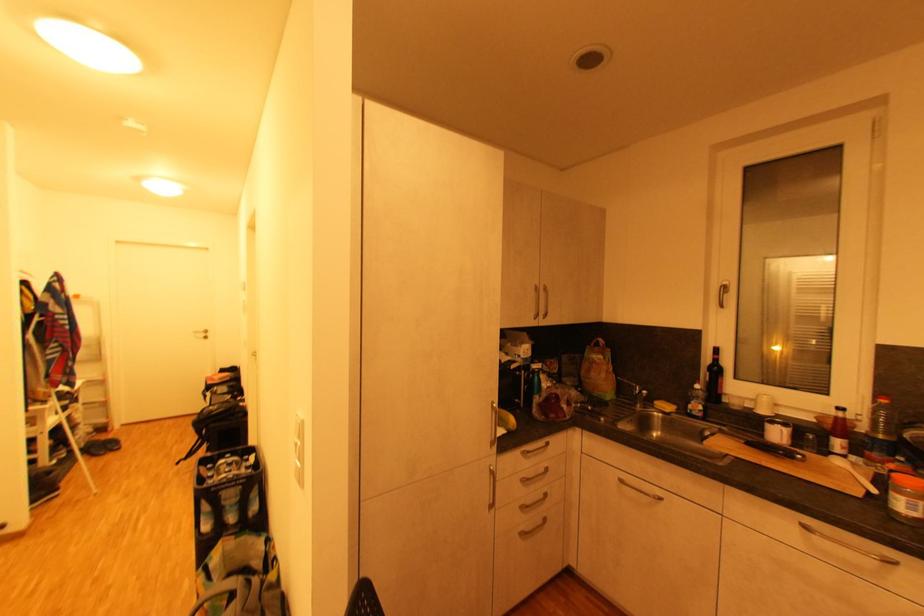
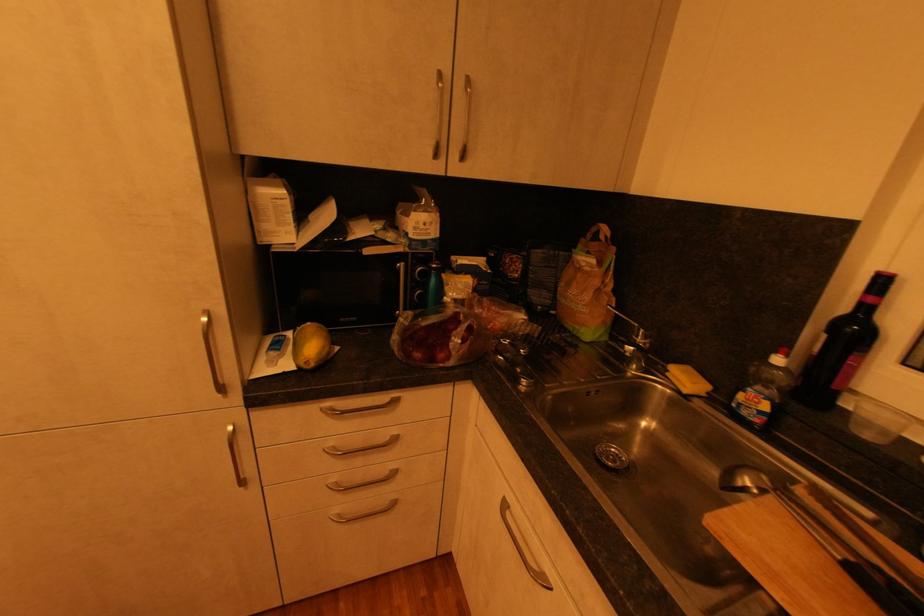
In the second image, find the point that corresponds to point 703,416 in the first image.

(760, 419)